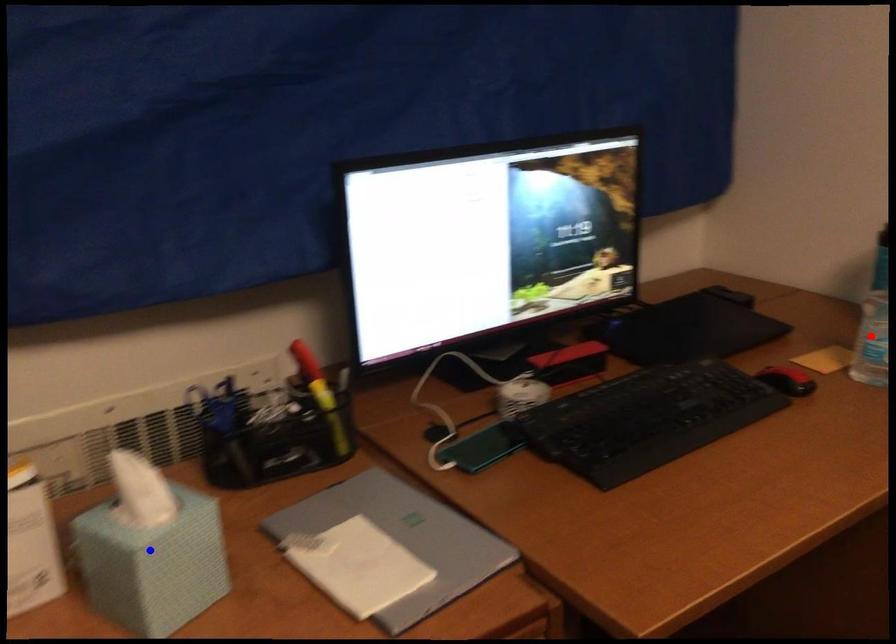
Question: Two points are marked on the image. Which point is closer to the camera?

Choices:
 (A) Blue point is closer.
 (B) Red point is closer.

Answer: (A)